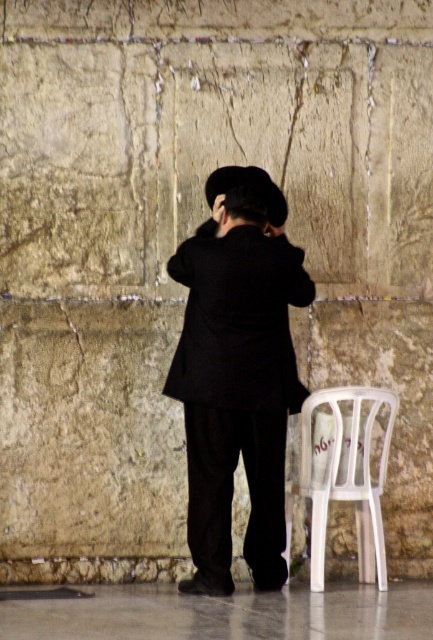
In the scene shown: You are standing in front of the stone wall and see the white plastic chair at lower right and the black felt hat at center. Which object is positioned lower in the image?

The white plastic chair at lower right is positioned lower than the black felt hat at center.